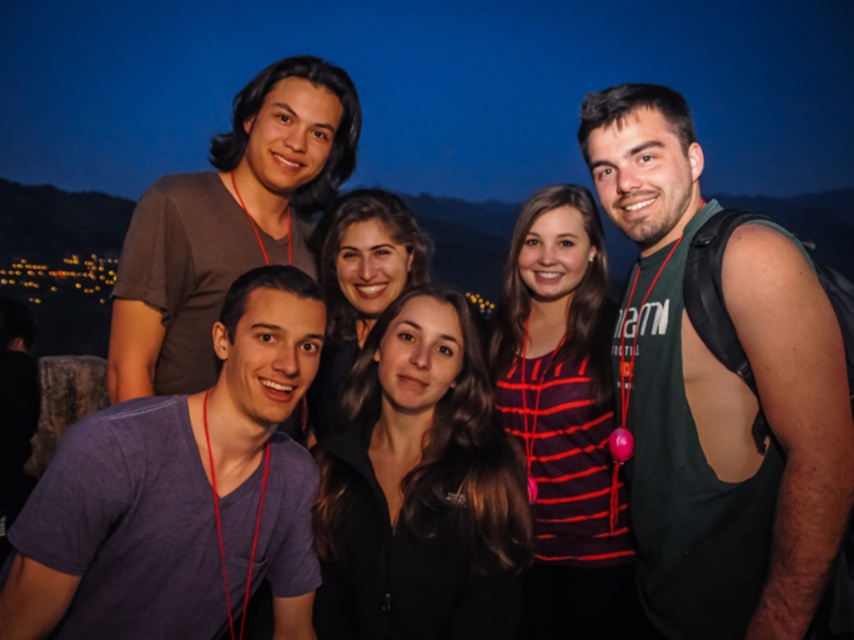
Question: Which is nearer to the purple cotton t-shirt at lower left?

Choices:
 (A) green sleeveless shirt at right
 (B) brown matte shirt at upper left

Answer: (B)

Question: Can you confirm if green sleeveless shirt at right is positioned to the right of brown matte shirt at upper left?

Choices:
 (A) yes
 (B) no

Answer: (A)

Question: Is green sleeveless shirt at right thinner than purple cotton t-shirt at lower left?

Choices:
 (A) yes
 (B) no

Answer: (A)

Question: Among these points, which one is nearest to the camera?

Choices:
 (A) (816, 472)
 (B) (303, 268)

Answer: (A)

Question: Is green sleeveless shirt at right wider than brown matte shirt at upper left?

Choices:
 (A) no
 (B) yes

Answer: (A)

Question: Which object is positioned closest to the purple cotton t-shirt at lower left?

Choices:
 (A) green sleeveless shirt at right
 (B) brown matte shirt at upper left

Answer: (B)